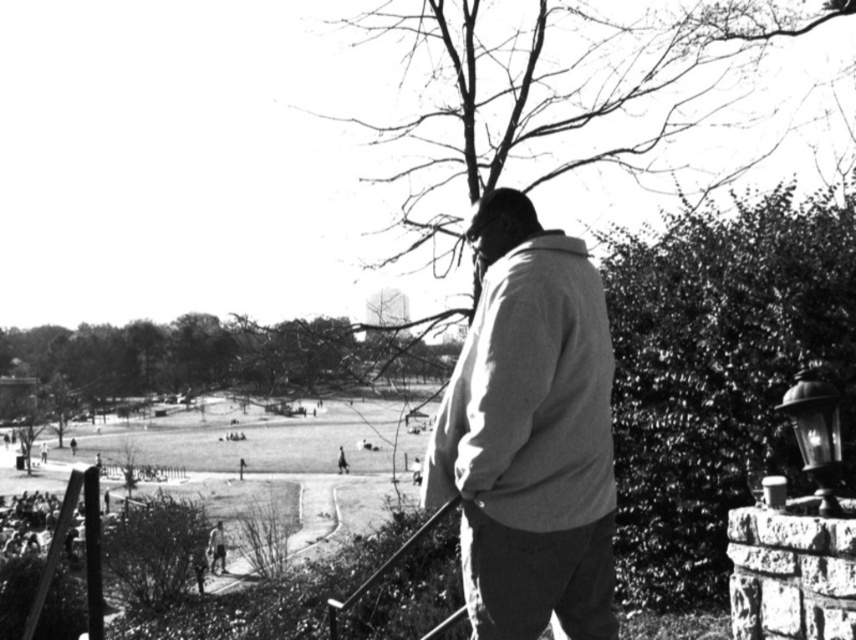
Question: Can you confirm if light gray cotton jacket at center is positioned to the left of smooth beige jacket at lower center?

Choices:
 (A) no
 (B) yes

Answer: (A)

Question: Which is farther from the light gray cotton jacket at center?

Choices:
 (A) smooth metal rail at lower center
 (B) smooth beige jacket at lower center

Answer: (B)

Question: Considering the real-world distances, which object is farthest from the smooth beige jacket at lower center?

Choices:
 (A) smooth metal rail at lower center
 (B) light gray cotton jacket at center

Answer: (B)

Question: Is smooth metal rail at lower center to the right of smooth beige jacket at lower center from the viewer's perspective?

Choices:
 (A) no
 (B) yes

Answer: (B)

Question: Does light gray cotton jacket at center appear over smooth metal rail at lower center?

Choices:
 (A) yes
 (B) no

Answer: (A)

Question: Estimate the real-world distances between objects in this image. Which object is farther from the smooth metal rail at lower center?

Choices:
 (A) light gray cotton jacket at center
 (B) smooth beige jacket at lower center

Answer: (B)